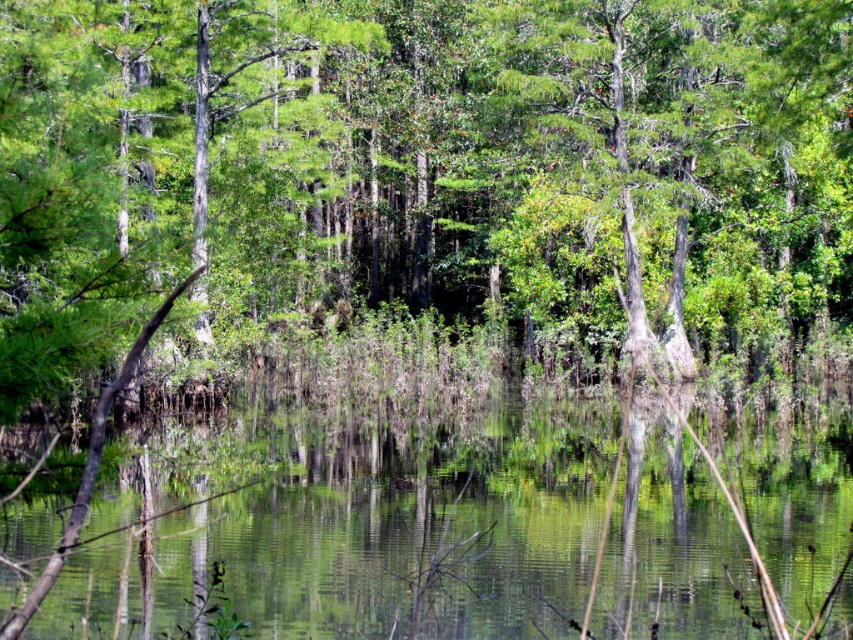
Question: Does green matte tree at center have a smaller size compared to green reflective water at center?

Choices:
 (A) no
 (B) yes

Answer: (A)

Question: Does green matte tree at center appear under green reflective water at center?

Choices:
 (A) yes
 (B) no

Answer: (B)

Question: Is green matte tree at center wider than green reflective water at center?

Choices:
 (A) no
 (B) yes

Answer: (B)

Question: Which point is farther to the camera?

Choices:
 (A) green matte tree at center
 (B) green reflective water at center

Answer: (A)

Question: Which point is farther from the camera taking this photo?

Choices:
 (A) (611, 10)
 (B) (280, 442)

Answer: (A)